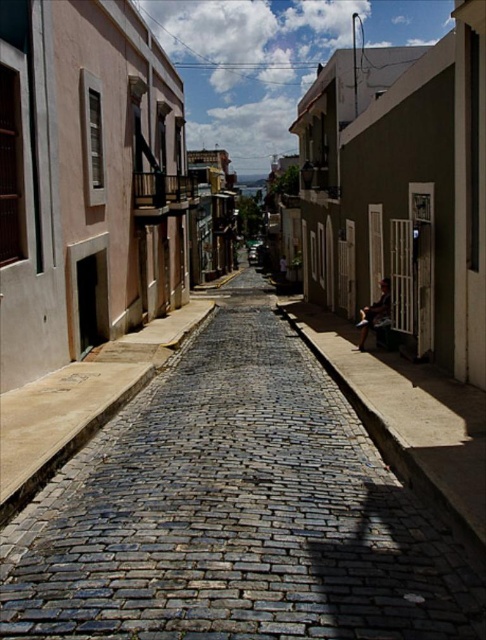
Question: Which point is closer to the camera?

Choices:
 (A) smooth stone bench at right
 (B) cobblestone street at center

Answer: (B)

Question: From the image, what is the correct spatial relationship of cobblestone street at center in relation to smooth stone bench at right?

Choices:
 (A) above
 (B) below

Answer: (B)

Question: Can you confirm if cobblestone street at center is positioned above smooth stone bench at right?

Choices:
 (A) no
 (B) yes

Answer: (A)

Question: From the image, what is the correct spatial relationship of cobblestone street at center in relation to smooth stone bench at right?

Choices:
 (A) right
 (B) left

Answer: (B)